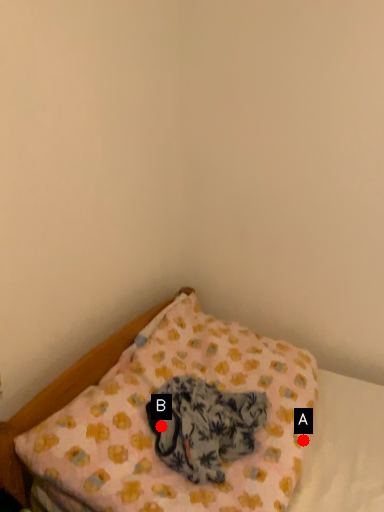
Question: Two points are circled on the image, labeled by A and B beside each circle. Which of the following is the closest to the observer?

Choices:
 (A) A is closer
 (B) B is closer

Answer: (B)